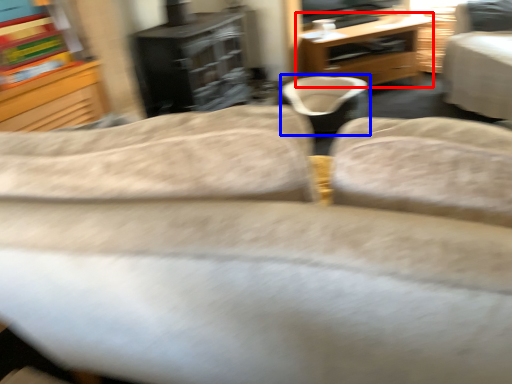
Question: Which of the following is the closest to the observer, desk (highlighted by a red box) or bean bag chair (highlighted by a blue box)?

Choices:
 (A) desk
 (B) bean bag chair

Answer: (B)